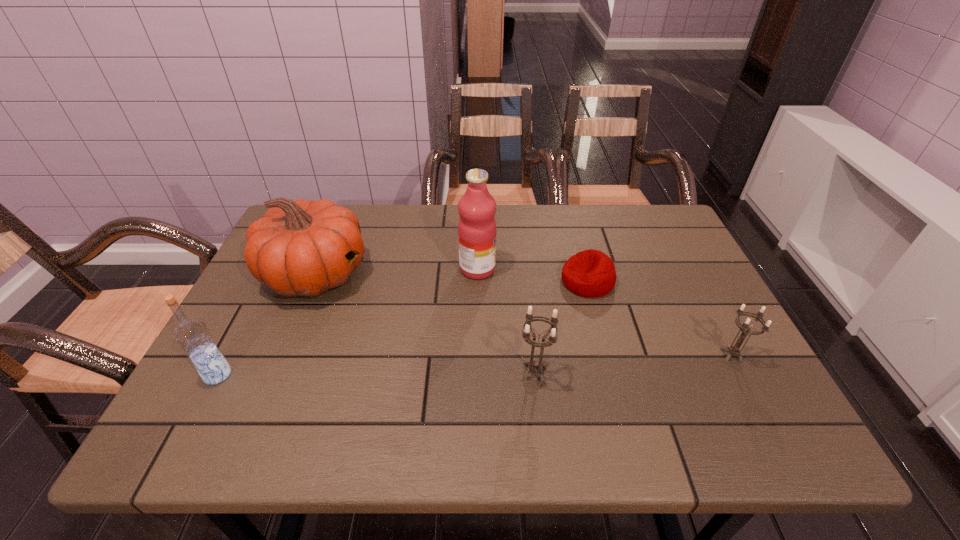
Identify the location of the taller candle holder. (534, 366).

Identify the location of the left candle holder. (534, 366).

The width and height of the screenshot is (960, 540). Identify the location of the rightmost object. (734, 350).

Locate an element on the screen. The width and height of the screenshot is (960, 540). the shorter candle holder is located at coordinates (734, 350).

Find the location of a particular element. This screenshot has width=960, height=540. pumpkin is located at coordinates (298, 248).

Image resolution: width=960 pixels, height=540 pixels. Find the location of `the tallest object`. the tallest object is located at coordinates (477, 229).

Find the location of a particular element. This screenshot has width=960, height=540. the third object from left to right is located at coordinates (477, 229).

At what (x,y) coordinates should I click in order to perform the action: click on the fifth object from left to right. Please return your answer as a coordinate pair (x, y). The width and height of the screenshot is (960, 540). Looking at the image, I should click on (591, 273).

Find the location of a particular element. The height and width of the screenshot is (540, 960). beanbag is located at coordinates (591, 273).

Where is `vodka`? The height and width of the screenshot is (540, 960). vodka is located at coordinates click(192, 335).